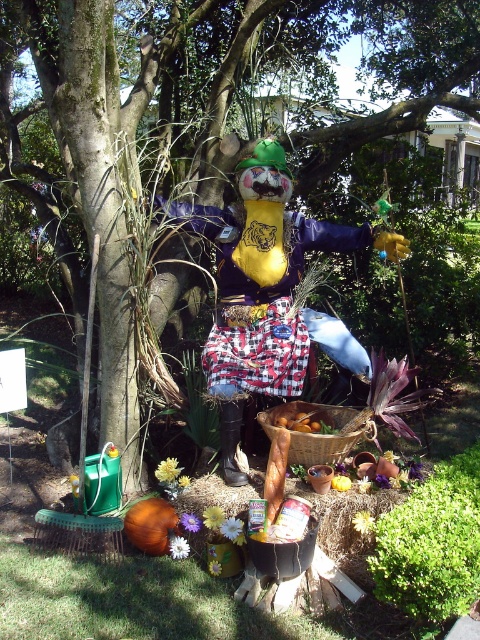
Question: Is matte yellow fabric scarecrow at center to the right of woven brown basket at center from the viewer's perspective?

Choices:
 (A) yes
 (B) no

Answer: (B)

Question: Is matte yellow fabric scarecrow at center closer to the viewer compared to woven brown basket at center?

Choices:
 (A) no
 (B) yes

Answer: (A)

Question: Which object appears closest to the camera in this image?

Choices:
 (A) matte yellow fabric scarecrow at center
 (B) woven brown basket at center

Answer: (B)

Question: Which point appears closest to the camera in this image?

Choices:
 (A) (350, 442)
 (B) (236, 250)

Answer: (A)

Question: Which of the following is the farthest from the observer?

Choices:
 (A) (235, 332)
 (B) (307, 435)

Answer: (A)

Question: Can you confirm if matte yellow fabric scarecrow at center is positioned above woven brown basket at center?

Choices:
 (A) no
 (B) yes

Answer: (B)